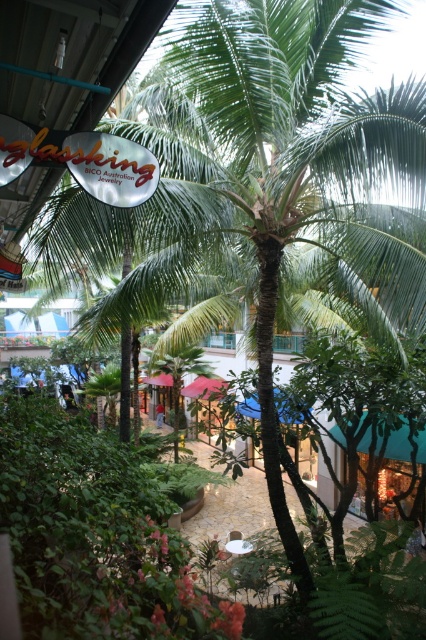
Question: Which of the following is the farthest from the observer?

Choices:
 (A) (170, 385)
 (B) (362, 438)

Answer: (A)

Question: In this image, where is teal fabric canopy at center located relative to red fabric canopy at center?

Choices:
 (A) above
 (B) below

Answer: (A)

Question: Estimate the real-world distances between objects in this image. Which object is farther from the blue fabric canopy at lower left?

Choices:
 (A) teal fabric canopy at center
 (B) green fabric canopy at center

Answer: (A)

Question: Is teal fabric canopy at center further to camera compared to blue fabric canopy at lower left?

Choices:
 (A) no
 (B) yes

Answer: (A)

Question: Considering the real-world distances, which object is farthest from the blue fabric canopy at lower left?

Choices:
 (A) green fabric canopy at center
 (B) pink fabric canopy at center

Answer: (A)

Question: Does teal fabric canopy at center appear under green fabric canopy at center?

Choices:
 (A) no
 (B) yes

Answer: (B)